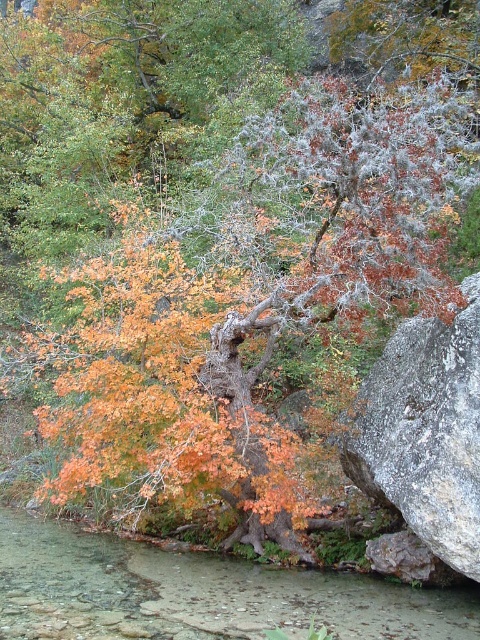
Question: Which of the following is the closest to the observer?

Choices:
 (A) (116, 614)
 (B) (451, 356)

Answer: (A)

Question: Which point appears closest to the camera in this image?

Choices:
 (A) (372, 448)
 (B) (17, 532)

Answer: (A)

Question: Does clear glass stream at lower left have a smaller size compared to gray rough rock at center?

Choices:
 (A) no
 (B) yes

Answer: (B)

Question: Can you confirm if clear glass stream at lower left is thinner than gray rough rock at center?

Choices:
 (A) no
 (B) yes

Answer: (A)

Question: Does clear glass stream at lower left appear under gray rough rock at center?

Choices:
 (A) yes
 (B) no

Answer: (A)